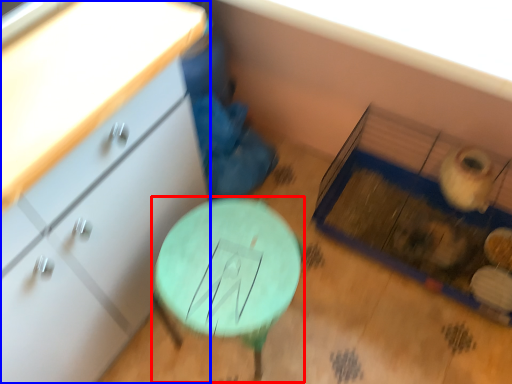
Question: Among these objects, which one is nearest to the camera, table (highlighted by a red box) or chest of drawers (highlighted by a blue box)?

Choices:
 (A) table
 (B) chest of drawers

Answer: (B)